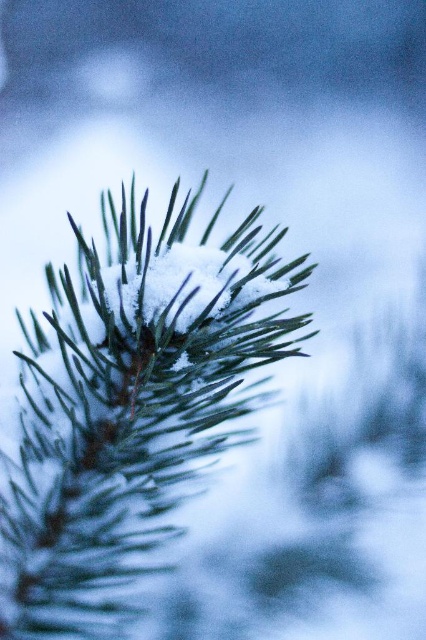
You are a photographer adjusting your camera focus on the green matte fir tree at center and the white fluffy snow at center. Which object should you focus on first to ensure the fir tree is sharp in the photo?

The green matte fir tree at center is closer to the viewer than the white fluffy snow at center, so focus on the green matte fir tree at center first to ensure it is in sharp focus before adjusting for the snow.

Consider the image. Please provide the coordinates of the green matte fir tree at center in the image. The coordinate system has its origin at the bottom left corner. The x and y coordinates should be given in the format of two decimal numbers separated by a comma.

The coordinates of the green matte fir tree at center are (x=129, y=406).

You are an artist trying to sketch this pine branch scene. You notice the green matte fir tree at center and the white fluffy snow at center. Based on their positions, which one should you draw first to maintain proper perspective?

The green matte fir tree at center should be drawn first because it is positioned to the left of the white fluffy snow at center, indicating it is closer to the viewer and should be placed in the foreground to maintain perspective.